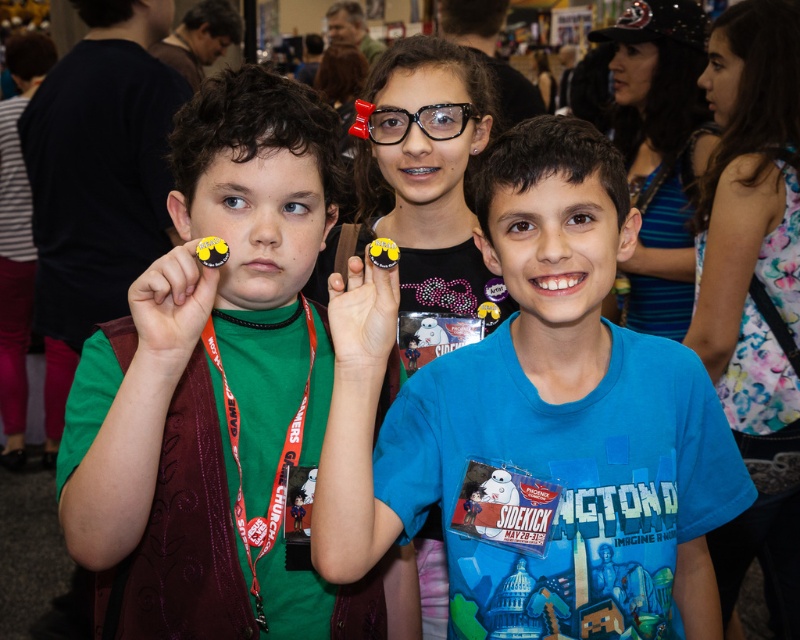
Question: Does green fabric vest at left appear under clear plastic glasses at center?

Choices:
 (A) yes
 (B) no

Answer: (A)

Question: Does blue matte shirt at center appear under red fabric lanyard at center?

Choices:
 (A) no
 (B) yes

Answer: (A)

Question: Which object is the closest to the clear plastic glasses at center?

Choices:
 (A) blue matte shirt at center
 (B) red fabric lanyard at center

Answer: (B)

Question: Can you confirm if red fabric lanyard at center is positioned to the right of clear plastic glasses at center?

Choices:
 (A) yes
 (B) no

Answer: (B)

Question: Based on their relative distances, which object is farther from the blue matte shirt at center?

Choices:
 (A) green fabric vest at left
 (B) clear plastic glasses at center
 (C) red fabric lanyard at center

Answer: (B)

Question: Which object appears closest to the camera in this image?

Choices:
 (A) blue matte shirt at center
 (B) green fabric vest at left

Answer: (B)